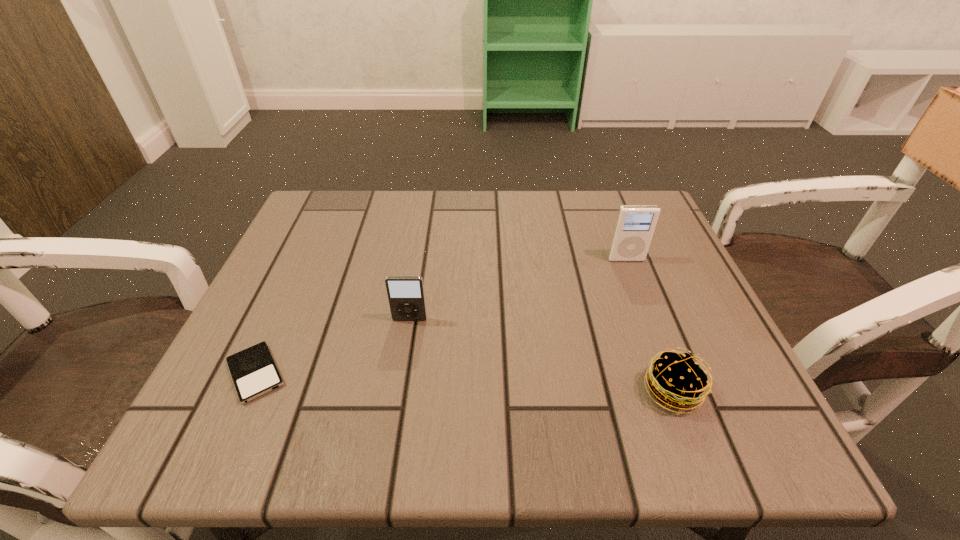
The width and height of the screenshot is (960, 540). In order to click on free point between the tallest iPod and the shortest iPod in this screenshot , I will do `click(441, 316)`.

The height and width of the screenshot is (540, 960). I want to click on vacant region between the farthest iPod and the leftmost iPod, so click(441, 316).

Where is `free space between the rightmost iPod and the leftmost iPod`? This screenshot has width=960, height=540. free space between the rightmost iPod and the leftmost iPod is located at coordinates (441, 316).

Identify the location of empty space between the leftmost object and the tallest iPod. (441, 316).

I want to click on empty location between the second farthest iPod and the farthest iPod, so click(517, 289).

Choose which object is the nearest neighbor to the farthest iPod. Please provide its 2D coordinates. Your answer should be formatted as a tuple, i.e. [(x, y)], where the tuple contains the x and y coordinates of a point satisfying the conditions above.

[(676, 380)]

What are the coordinates of `the closest object to the third nearest object` in the screenshot? It's located at pos(254,372).

Where is `iPod that stands as the closest to the tallest object`? The height and width of the screenshot is (540, 960). iPod that stands as the closest to the tallest object is located at coordinates (406, 297).

Select which iPod appears as the second closest to the tallest object. Please provide its 2D coordinates. Your answer should be formatted as a tuple, i.e. [(x, y)], where the tuple contains the x and y coordinates of a point satisfying the conditions above.

[(254, 372)]

This screenshot has width=960, height=540. Identify the location of free space that satisfies the following two spatial constraints: 1. on the front-facing side of the third tallest object; 2. on the left side of the third shortest object. (398, 392).